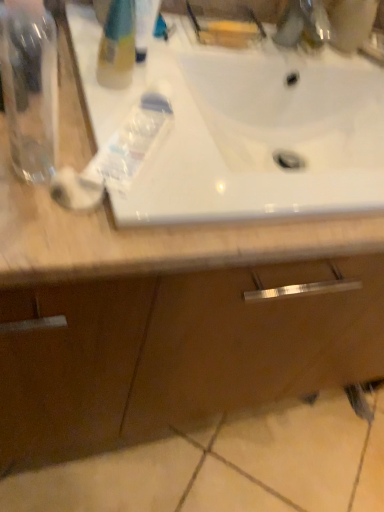
Question: Does metallic faucet at upper right have a greater width compared to translucent plastic bottle at upper left?

Choices:
 (A) no
 (B) yes

Answer: (B)

Question: Is metallic faucet at upper right touching translucent plastic bottle at upper left?

Choices:
 (A) yes
 (B) no

Answer: (B)

Question: Would you say metallic faucet at upper right contains translucent plastic bottle at upper left?

Choices:
 (A) yes
 (B) no

Answer: (B)

Question: Is metallic faucet at upper right oriented towards translucent plastic bottle at upper left?

Choices:
 (A) no
 (B) yes

Answer: (A)

Question: Considering the relative sizes of metallic faucet at upper right and translucent plastic bottle at upper left in the image provided, is metallic faucet at upper right smaller than translucent plastic bottle at upper left?

Choices:
 (A) yes
 (B) no

Answer: (A)

Question: Considering the positions of transparent plastic bottle at left and white glossy sink at upper center in the image, is transparent plastic bottle at left taller or shorter than white glossy sink at upper center?

Choices:
 (A) tall
 (B) short

Answer: (A)

Question: In the image, is transparent plastic bottle at left positioned in front of or behind white glossy sink at upper center?

Choices:
 (A) behind
 (B) front

Answer: (B)

Question: Is transparent plastic bottle at left to the left or to the right of white glossy sink at upper center in the image?

Choices:
 (A) left
 (B) right

Answer: (A)

Question: Considering the positions of transparent plastic bottle at left and white glossy sink at upper center in the image, is transparent plastic bottle at left wider or thinner than white glossy sink at upper center?

Choices:
 (A) thin
 (B) wide

Answer: (A)

Question: Is transparent plastic bottle at left inside or outside of metallic faucet at upper right?

Choices:
 (A) outside
 (B) inside

Answer: (A)

Question: From the image's perspective, relative to metallic faucet at upper right, is transparent plastic bottle at left above or below?

Choices:
 (A) below
 (B) above

Answer: (A)

Question: From a real-world perspective, is transparent plastic bottle at left above or below metallic faucet at upper right?

Choices:
 (A) below
 (B) above

Answer: (B)

Question: Is point (31, 59) positioned closer to the camera than point (299, 7)?

Choices:
 (A) farther
 (B) closer

Answer: (B)

Question: Do you think metallic faucet at upper right is within translucent plastic bottle at upper left, or outside of it?

Choices:
 (A) outside
 (B) inside

Answer: (A)

Question: From a real-world perspective, is metallic faucet at upper right above or below translucent plastic bottle at upper left?

Choices:
 (A) above
 (B) below

Answer: (B)